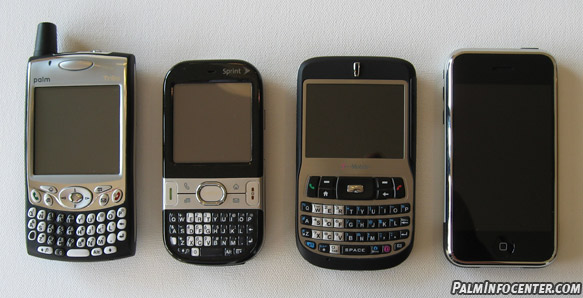
Locate an element on the screen. Image resolution: width=583 pixels, height=298 pixels. reflection of a light from the celling is located at coordinates (240, 90).